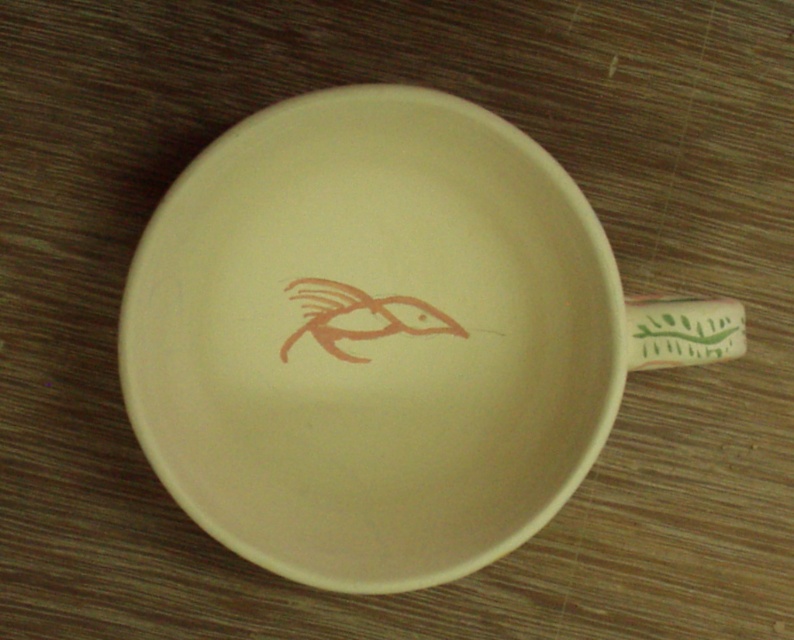
You are looking at the cup from the front. There are two points marked on the cup. The first point is at coordinates point [332,508] and the second is at point [685,362]. Which point is closer to you?

Point [685,362] is closer to you because it is in front of point [332,508].

You are trying to place a small spoon on the matte ceramic saucer at center without it hanging over the edge. Considering the green leafy design at right, which is part of the cup handle, can you determine if the saucer is wide enough to accommodate the spoon?

The matte ceramic saucer at center might be wider than green leafy design at right, so there is a possibility that the saucer is wide enough to hold the spoon without it hanging over the edge. However, the exact dimensions are uncertain based on the provided information.